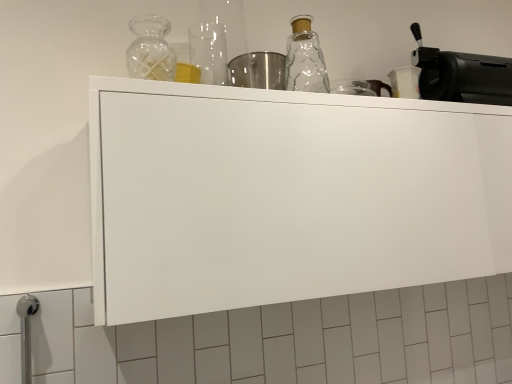
Question: Considering the relative positions of white matte cabinet at upper center and black matte coffee machine at upper right in the image provided, is white matte cabinet at upper center to the right of black matte coffee machine at upper right from the viewer's perspective?

Choices:
 (A) yes
 (B) no

Answer: (B)

Question: From a real-world perspective, is white matte cabinet at upper center over black matte coffee machine at upper right?

Choices:
 (A) no
 (B) yes

Answer: (A)

Question: Is white matte cabinet at upper center facing away from black matte coffee machine at upper right?

Choices:
 (A) no
 (B) yes

Answer: (A)

Question: From the image's perspective, is white matte cabinet at upper center under black matte coffee machine at upper right?

Choices:
 (A) no
 (B) yes

Answer: (B)

Question: Can you confirm if white matte cabinet at upper center is shorter than black matte coffee machine at upper right?

Choices:
 (A) no
 (B) yes

Answer: (A)

Question: Does white matte cabinet at upper center have a larger size compared to black matte coffee machine at upper right?

Choices:
 (A) yes
 (B) no

Answer: (A)

Question: Is the position of black matte coffee machine at upper right more distant than that of clear glass bottle at upper center?

Choices:
 (A) no
 (B) yes

Answer: (B)

Question: Does black matte coffee machine at upper right appear on the right side of clear glass bottle at upper center?

Choices:
 (A) no
 (B) yes

Answer: (B)

Question: Does black matte coffee machine at upper right have a larger size compared to clear glass bottle at upper center?

Choices:
 (A) yes
 (B) no

Answer: (A)

Question: Is black matte coffee machine at upper right aimed at clear glass bottle at upper center?

Choices:
 (A) no
 (B) yes

Answer: (A)

Question: From the image's perspective, is black matte coffee machine at upper right located above clear glass bottle at upper center?

Choices:
 (A) yes
 (B) no

Answer: (A)

Question: From a real-world perspective, is black matte coffee machine at upper right over clear glass bottle at upper center?

Choices:
 (A) no
 (B) yes

Answer: (B)

Question: Would you say clear glass bottle at upper center is part of white matte cabinet at upper center's contents?

Choices:
 (A) yes
 (B) no

Answer: (B)